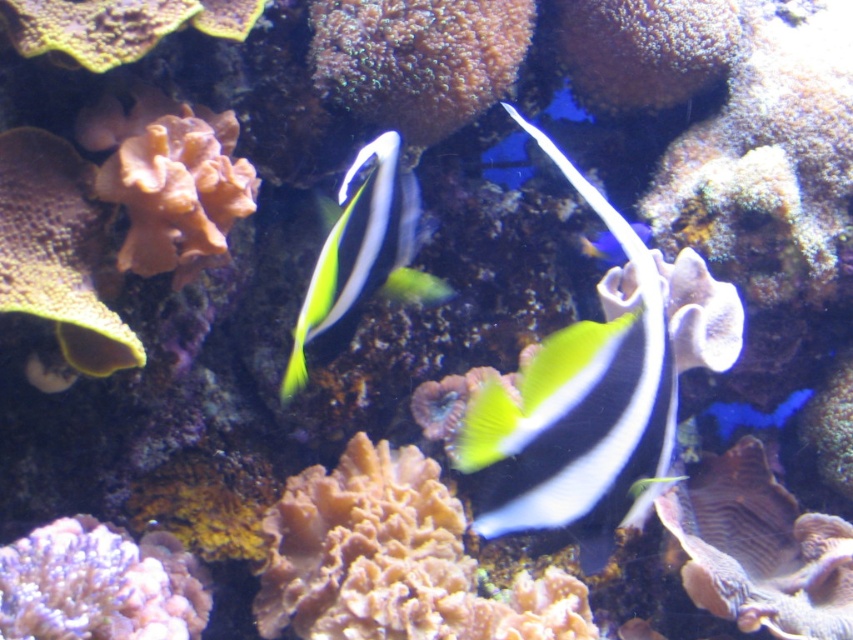
You are a marine biologist observing an underwater scene with two corals. You need to determine which coral is wider. The corals are the green textured coral at center and the orange coral at center. Which one is wider?

The green textured coral at center is wider than the orange coral at center.

You are a marine biologist observing an underwater scene. You notice a point marked at coordinates (579, 412). Based on the scene description, which object does this point correspond to?

The point at coordinates (579, 412) is on the black and white striped fish at center.